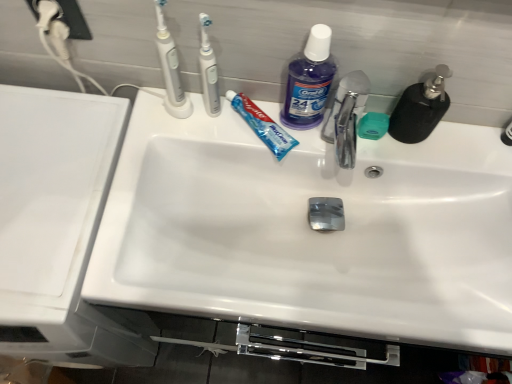
What do you see at coordinates (346, 117) in the screenshot? The height and width of the screenshot is (384, 512). I see `chrome metallic faucet at center` at bounding box center [346, 117].

The height and width of the screenshot is (384, 512). What do you see at coordinates (208, 70) in the screenshot?
I see `white plastic toothbrush at upper center, which ranks as the 2th toothbrush in left-to-right order` at bounding box center [208, 70].

Image resolution: width=512 pixels, height=384 pixels. What do you see at coordinates (170, 69) in the screenshot?
I see `white plastic toothbrush at upper left, which appears as the 2th toothbrush when viewed from the right` at bounding box center [170, 69].

Where is `chrome metallic faucet at center`? This screenshot has width=512, height=384. chrome metallic faucet at center is located at coordinates (346, 117).

From a real-world perspective, is blue glossy toothpaste at center physically below green matte soap at center?

Yes.

Is blue glossy toothpaste at center not close to green matte soap at center?

blue glossy toothpaste at center is near green matte soap at center, not far away.

Can you confirm if blue glossy toothpaste at center is thinner than green matte soap at center?

In fact, blue glossy toothpaste at center might be wider than green matte soap at center.

Consider the image. Is green matte soap at center surrounded by blue glossy toothpaste at center?

No, green matte soap at center is located outside of blue glossy toothpaste at center.

Which object is further away from the camera, chrome metallic faucet at center or black matte soap dispenser at upper right?

black matte soap dispenser at upper right is behind.

Looking at this image, would you say chrome metallic faucet at center is inside or outside black matte soap dispenser at upper right?

chrome metallic faucet at center is located beyond the bounds of black matte soap dispenser at upper right.

Is point (346, 76) less distant than point (442, 95)?

No, it is not.

Is chrome metallic faucet at center looking in the opposite direction of black matte soap dispenser at upper right?

No, black matte soap dispenser at upper right is not at the back of chrome metallic faucet at center.

Find the location of `tap on the left of black matte soap dispenser at upper right`. tap on the left of black matte soap dispenser at upper right is located at coordinates (346, 117).

In terms of height, does black matte soap dispenser at upper right look taller or shorter compared to chrome metallic faucet at center?

black matte soap dispenser at upper right is taller than chrome metallic faucet at center.

Between black matte soap dispenser at upper right and chrome metallic faucet at center, which one appears on the right side from the viewer's perspective?

black matte soap dispenser at upper right is more to the right.

Based on their positions, is green matte soap at center located to the left or right of white glossy sink at center?

In the image, green matte soap at center appears on the right side of white glossy sink at center.

Can you confirm if green matte soap at center is smaller than white glossy sink at center?

Yes.

Is green matte soap at center situated inside white glossy sink at center or outside?

green matte soap at center exists outside the volume of white glossy sink at center.

From the image's perspective, is green matte soap at center on top of white glossy sink at center?

Yes, from the image's perspective, green matte soap at center is over white glossy sink at center.

Is white plastic toothbrush at upper center, which ranks as the 1th toothbrush in right-to-left order, wider or thinner than white glossy sink at left?

Clearly, white plastic toothbrush at upper center, which ranks as the 1th toothbrush in right-to-left order, has less width compared to white glossy sink at left.

Considering the sizes of white plastic toothbrush at upper center, which ranks as the 1th toothbrush in right-to-left order, and white glossy sink at left in the image, is white plastic toothbrush at upper center, which ranks as the 1th toothbrush in right-to-left order, bigger or smaller than white glossy sink at left?

Clearly, white plastic toothbrush at upper center, which ranks as the 1th toothbrush in right-to-left order, is smaller in size than white glossy sink at left.

From the image's perspective, is white plastic toothbrush at upper center, which ranks as the 2th toothbrush in left-to-right order, beneath white glossy sink at left?

Incorrect, from the image's perspective, white plastic toothbrush at upper center, which ranks as the 2th toothbrush in left-to-right order, is higher than white glossy sink at left.

Does point (364, 135) appear closer or farther from the camera than point (208, 79)?

Clearly, point (364, 135) is more distant from the camera than point (208, 79).

In terms of height, does green matte soap at center look taller or shorter compared to white plastic toothbrush at upper center, which ranks as the 2th toothbrush in left-to-right order?

Considering their sizes, green matte soap at center has less height than white plastic toothbrush at upper center, which ranks as the 2th toothbrush in left-to-right order.

Considering the sizes of objects green matte soap at center and white plastic toothbrush at upper center, which ranks as the 1th toothbrush in right-to-left order, in the image provided, who is bigger, green matte soap at center or white plastic toothbrush at upper center, which ranks as the 1th toothbrush in right-to-left order,?

white plastic toothbrush at upper center, which ranks as the 1th toothbrush in right-to-left order, is bigger.

Is blue glossy toothpaste at center surrounded by white glossy sink at left?

Definitely not — blue glossy toothpaste at center is not inside white glossy sink at left.

Considering the sizes of objects white glossy sink at left and blue glossy toothpaste at center in the image provided, who is bigger, white glossy sink at left or blue glossy toothpaste at center?

white glossy sink at left is bigger.

You are a GUI agent. You are given a task and a screenshot of the screen. Output one action in this format:
    pyautogui.click(x=<x>, y=<y>)
    Task: Click on the soap below the blue glossy toothpaste at center (from the image's perspective)
    The width and height of the screenshot is (512, 384).
    Given the screenshot: What is the action you would take?
    pyautogui.click(x=373, y=125)

Image resolution: width=512 pixels, height=384 pixels. What are the coordinates of `soap dispenser above the chrome metallic faucet at center (from a real-world perspective)` in the screenshot? It's located at (420, 108).

Which object lies nearer to the anchor point white plastic toothbrush at upper center, which ranks as the 2th toothbrush in left-to-right order, green matte soap at center or purple translucent liquid at upper center?

Based on the image, purple translucent liquid at upper center appears to be nearer to white plastic toothbrush at upper center, which ranks as the 2th toothbrush in left-to-right order.

Estimate the real-world distances between objects in this image. Which object is further from white glossy sink at center, white plastic toothbrush at upper center, which ranks as the 1th toothbrush in right-to-left order, or purple translucent liquid at upper center?

white plastic toothbrush at upper center, which ranks as the 1th toothbrush in right-to-left order.

When comparing their distances from green matte soap at center, does white plastic toothbrush at upper left, placed as the 1th toothbrush when sorted from left to right, or chrome metallic faucet at center seem further?

white plastic toothbrush at upper left, placed as the 1th toothbrush when sorted from left to right, lies further to green matte soap at center than the other object.

Consider the image. Estimate the real-world distances between objects in this image. Which object is further from white glossy sink at center, white plastic toothbrush at upper center, which ranks as the 1th toothbrush in right-to-left order, or chrome metallic faucet at center?

white plastic toothbrush at upper center, which ranks as the 1th toothbrush in right-to-left order, lies further to white glossy sink at center than the other object.

Which object lies nearer to the anchor point white plastic toothbrush at upper center, which ranks as the 1th toothbrush in right-to-left order, white plastic toothbrush at upper left, placed as the 1th toothbrush when sorted from left to right, or purple translucent liquid at upper center?

Based on the image, white plastic toothbrush at upper left, placed as the 1th toothbrush when sorted from left to right, appears to be nearer to white plastic toothbrush at upper center, which ranks as the 1th toothbrush in right-to-left order.

Considering their positions, is purple translucent liquid at upper center positioned closer to black matte soap dispenser at upper right than white glossy sink at center?

purple translucent liquid at upper center lies closer to black matte soap dispenser at upper right than the other object.

From the image, which object appears to be farther from chrome metallic faucet at center, white plastic toothbrush at upper center, which ranks as the 2th toothbrush in left-to-right order, or white plastic toothbrush at upper left, which appears as the 2th toothbrush when viewed from the right?

Among the two, white plastic toothbrush at upper left, which appears as the 2th toothbrush when viewed from the right, is located further to chrome metallic faucet at center.

When comparing their distances from blue glossy toothpaste at center, does chrome metallic faucet at center or white plastic toothbrush at upper center, which ranks as the 2th toothbrush in left-to-right order, seem further?

chrome metallic faucet at center.

What are the coordinates of `tap between white plastic toothbrush at upper left, which appears as the 2th toothbrush when viewed from the right, and green matte soap at center from left to right` in the screenshot? It's located at (346, 117).

The image size is (512, 384). I want to click on soap situated between purple translucent liquid at upper center and black matte soap dispenser at upper right from left to right, so click(x=373, y=125).

I want to click on cleaning product between white plastic toothbrush at upper center, which ranks as the 1th toothbrush in right-to-left order, and chrome metallic faucet at center, in the horizontal direction, so click(x=309, y=82).

Locate an element on the screen. cleaning product situated between white glossy sink at left and black matte soap dispenser at upper right from left to right is located at coordinates tap(309, 82).